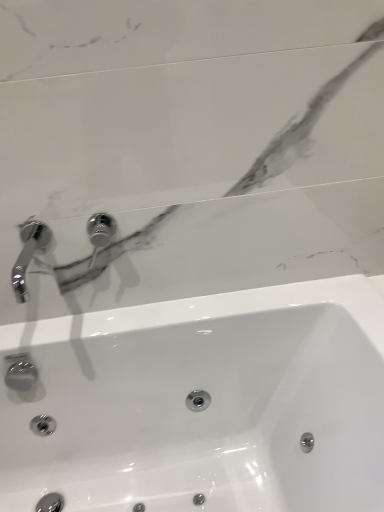
Question: Considering the relative sizes of chrome metallic faucet at upper left, marked as the second tap in a right-to-left arrangement, and white glossy sink at center in the image provided, is chrome metallic faucet at upper left, marked as the second tap in a right-to-left arrangement, smaller than white glossy sink at center?

Choices:
 (A) no
 (B) yes

Answer: (B)

Question: From the image's perspective, is chrome metallic faucet at upper left, marked as the second tap in a right-to-left arrangement, under white glossy sink at center?

Choices:
 (A) no
 (B) yes

Answer: (A)

Question: Does chrome metallic faucet at upper left, the first tap viewed from the left, have a lesser height compared to white glossy sink at center?

Choices:
 (A) yes
 (B) no

Answer: (A)

Question: Is white glossy sink at center located within chrome metallic faucet at upper left, marked as the second tap in a right-to-left arrangement?

Choices:
 (A) no
 (B) yes

Answer: (A)

Question: Considering the relative sizes of chrome metallic faucet at upper left, marked as the second tap in a right-to-left arrangement, and white glossy sink at center in the image provided, is chrome metallic faucet at upper left, marked as the second tap in a right-to-left arrangement, wider than white glossy sink at center?

Choices:
 (A) yes
 (B) no

Answer: (B)

Question: Looking at the image, does white glossy sink at center seem bigger or smaller compared to polished chrome tap at upper center, positioned as the second tap in left-to-right order?

Choices:
 (A) small
 (B) big

Answer: (B)

Question: From the image's perspective, is white glossy sink at center above or below polished chrome tap at upper center, positioned as the second tap in left-to-right order?

Choices:
 (A) above
 (B) below

Answer: (B)

Question: From their relative heights in the image, would you say white glossy sink at center is taller or shorter than polished chrome tap at upper center, the first tap from the right?

Choices:
 (A) tall
 (B) short

Answer: (A)

Question: Is white glossy sink at center to the left or to the right of polished chrome tap at upper center, positioned as the second tap in left-to-right order, in the image?

Choices:
 (A) right
 (B) left

Answer: (A)

Question: Considering the positions of chrome metallic faucet at upper left, marked as the second tap in a right-to-left arrangement, and white glossy sink at center in the image, is chrome metallic faucet at upper left, marked as the second tap in a right-to-left arrangement, taller or shorter than white glossy sink at center?

Choices:
 (A) tall
 (B) short

Answer: (B)

Question: Is point (36, 243) positioned closer to the camera than point (168, 501)?

Choices:
 (A) farther
 (B) closer

Answer: (B)

Question: Is chrome metallic faucet at upper left, marked as the second tap in a right-to-left arrangement, to the left or to the right of white glossy sink at center in the image?

Choices:
 (A) right
 (B) left

Answer: (B)

Question: From the image's perspective, is chrome metallic faucet at upper left, the first tap viewed from the left, positioned above or below white glossy sink at center?

Choices:
 (A) above
 (B) below

Answer: (A)

Question: Is white glossy sink at center inside or outside of chrome metallic faucet at upper left, the first tap viewed from the left?

Choices:
 (A) outside
 (B) inside

Answer: (A)

Question: From a real-world perspective, is white glossy sink at center positioned above or below chrome metallic faucet at upper left, marked as the second tap in a right-to-left arrangement?

Choices:
 (A) below
 (B) above

Answer: (A)